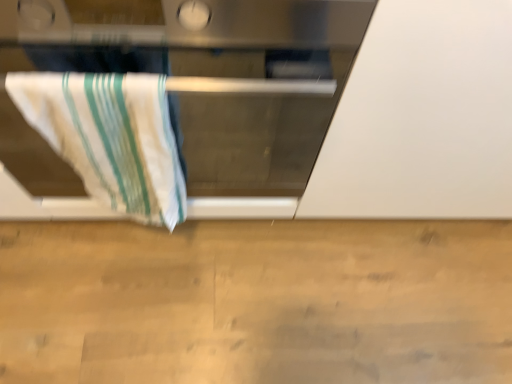
Identify the location of white cotton towel at left. (110, 137).

Image resolution: width=512 pixels, height=384 pixels. Describe the element at coordinates (110, 137) in the screenshot. I see `white cotton towel at left` at that location.

In order to face white matte oven at upper left, should I rotate leftwards or rightwards?

Rotate your view left by about 12.399°.

Where is `white matte oven at upper left`? The image size is (512, 384). white matte oven at upper left is located at coordinates (221, 82).

Measure the distance between white matte oven at upper left and camera.

19.53 inches.

The height and width of the screenshot is (384, 512). Describe the element at coordinates (221, 82) in the screenshot. I see `white matte oven at upper left` at that location.

Locate an element on the screen. white cotton towel at left is located at coordinates 110,137.

Considering the positions of objects white matte oven at upper left and white cotton towel at left in the image provided, who is more to the right, white matte oven at upper left or white cotton towel at left?

Positioned to the right is white matte oven at upper left.

Which object is closer to the camera taking this photo, white matte oven at upper left or white cotton towel at left?

white matte oven at upper left is more forward.

Which is closer to the camera, (20, 53) or (77, 83)?

Point (77, 83)

From the image's perspective, is white matte oven at upper left below white cotton towel at left?

Incorrect, from the image's perspective, white matte oven at upper left is higher than white cotton towel at left.

From a real-world perspective, which object rests below the other?

In real-world perspective, white cotton towel at left is lower.

Does white matte oven at upper left have a greater width compared to white cotton towel at left?

Yes.

Is white matte oven at upper left taller or shorter than white cotton towel at left?

Considering their sizes, white matte oven at upper left has more height than white cotton towel at left.

Considering the sizes of objects white matte oven at upper left and white cotton towel at left in the image provided, who is bigger, white matte oven at upper left or white cotton towel at left?

white matte oven at upper left.

Is white matte oven at upper left inside or outside of white cotton towel at left?

white matte oven at upper left cannot be found inside white cotton towel at left.

Are white matte oven at upper left and white cotton towel at left located far from each other?

No, white matte oven at upper left is not far from white cotton towel at left.

Is white matte oven at upper left facing towards white cotton towel at left?

Yes.

How different are the orientations of white matte oven at upper left and white cotton towel at left in degrees?

0.000133 degrees.

The height and width of the screenshot is (384, 512). What are the coordinates of `oven on the right of white cotton towel at left` in the screenshot? It's located at (221, 82).

Between white cotton towel at left and white matte oven at upper left, which one appears on the right side from the viewer's perspective?

From the viewer's perspective, white matte oven at upper left appears more on the right side.

Considering the positions of objects white cotton towel at left and white matte oven at upper left in the image provided, who is behind, white cotton towel at left or white matte oven at upper left?

Positioned behind is white cotton towel at left.

Is point (158, 154) positioned after point (179, 2)?

Yes, point (158, 154) is behind point (179, 2).

From the picture: From the image's perspective, which is below, white cotton towel at left or white matte oven at upper left?

white cotton towel at left appears lower in the image.

From a real-world perspective, between white cotton towel at left and white matte oven at upper left, who is vertically lower?

white cotton towel at left.

Which object is wider, white cotton towel at left or white matte oven at upper left?

white matte oven at upper left.

From their relative heights in the image, would you say white cotton towel at left is taller or shorter than white matte oven at upper left?

white cotton towel at left is shorter than white matte oven at upper left.

From the picture: Who is smaller, white cotton towel at left or white matte oven at upper left?

With smaller size is white cotton towel at left.

Choose the correct answer: Is white cotton towel at left inside white matte oven at upper left or outside it?

white cotton towel at left fits inside white matte oven at upper left.

Can you see white cotton towel at left touching white matte oven at upper left?

No, white cotton towel at left is not beside white matte oven at upper left.

Could you tell me if white cotton towel at left is turned towards white matte oven at upper left?

Yes, white cotton towel at left is facing white matte oven at upper left.

How many degrees apart are the facing directions of white cotton towel at left and white matte oven at upper left?

0.000133 degrees.

At what (x,y) coordinates should I click in order to perform the action: click on towel beneath the white matte oven at upper left (from a real-world perspective). Please return your answer as a coordinate pair (x, y). Image resolution: width=512 pixels, height=384 pixels. Looking at the image, I should click on (110, 137).

Where is `towel that is under the white matte oven at upper left (from a real-world perspective)`? This screenshot has height=384, width=512. towel that is under the white matte oven at upper left (from a real-world perspective) is located at coordinates (110, 137).

Where is `towel lying on the left of white matte oven at upper left`? This screenshot has height=384, width=512. towel lying on the left of white matte oven at upper left is located at coordinates (110, 137).